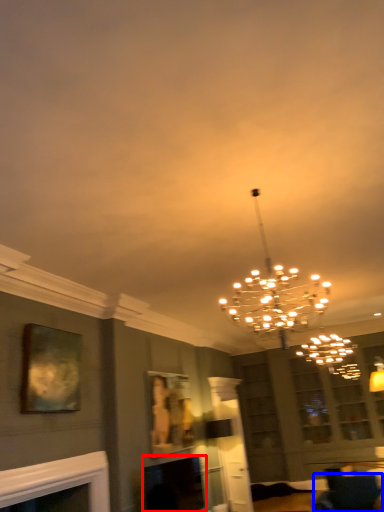
Question: Among these objects, which one is farthest to the camera, fireplace (highlighted by a red box) or furniture (highlighted by a blue box)?

Choices:
 (A) fireplace
 (B) furniture

Answer: (A)